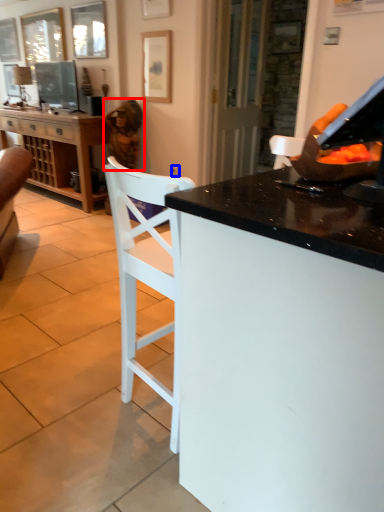
Question: Which object is further to the camera taking this photo, woman (highlighted by a red box) or power outlet (highlighted by a blue box)?

Choices:
 (A) woman
 (B) power outlet

Answer: (B)